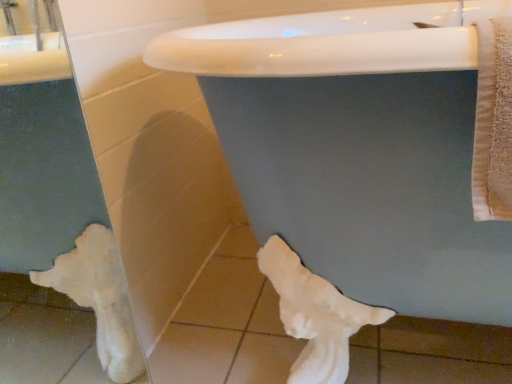
Find the location of a particular element. This screenshot has width=512, height=384. white glossy bath at lower left is located at coordinates (358, 150).

What is the approximate width of white glossy bath at lower left?

white glossy bath at lower left is 31.64 inches in width.

Describe the element at coordinates (358, 150) in the screenshot. I see `white glossy bath at lower left` at that location.

The width and height of the screenshot is (512, 384). Find the location of `white glossy bath at lower left`. white glossy bath at lower left is located at coordinates (358, 150).